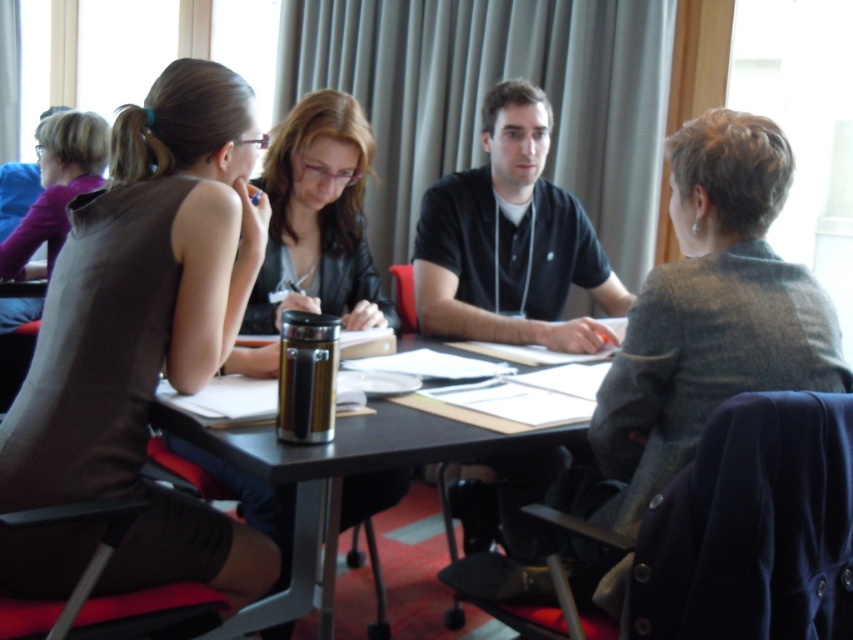
Does black cotton shirt at center have a greater width compared to metallic silver thermos at center?

No.

Who is taller, black cotton shirt at center or metallic silver thermos at center?

With more height is black cotton shirt at center.

You are a GUI agent. You are given a task and a screenshot of the screen. Output one action in this format:
    pyautogui.click(x=<x>, y=<y>)
    Task: Click on the black cotton shirt at center
    
    Given the screenshot: What is the action you would take?
    tap(509, 241)

Where is `black cotton shirt at center`? This screenshot has width=853, height=640. black cotton shirt at center is located at coordinates (509, 241).

Does point (219, 522) come closer to viewer compared to point (103, 148)?

Yes.

Can you confirm if brown fabric dress at upper left is taller than matte brown shirt at upper left?

Indeed, brown fabric dress at upper left has a greater height compared to matte brown shirt at upper left.

Is point (141, 218) positioned after point (44, 182)?

No, (141, 218) is closer to viewer.

Where is `brown fabric dress at upper left`? This screenshot has width=853, height=640. brown fabric dress at upper left is located at coordinates (138, 289).

Which of these two, black cotton shirt at center or matte brown shirt at upper left, stands taller?

Standing taller between the two is matte brown shirt at upper left.

Who is positioned more to the left, black cotton shirt at center or matte brown shirt at upper left?

matte brown shirt at upper left

Which is behind, point (563, 269) or point (9, 314)?

The point (9, 314) is more distant.

Identify the location of black cotton shirt at center. The width and height of the screenshot is (853, 640). (509, 241).